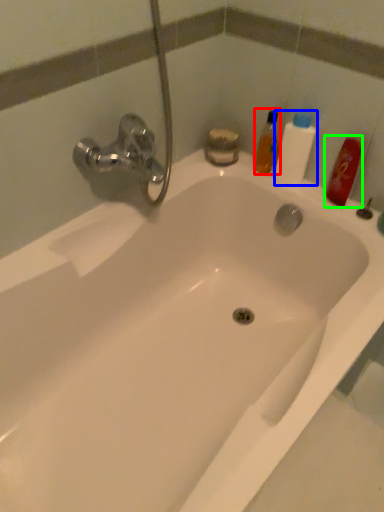
Question: Considering the real-world distances, which object is farthest from mouthwash (highlighted by a red box)? cleaning product (highlighted by a blue box) or mouthwash (highlighted by a green box)?

Choices:
 (A) cleaning product
 (B) mouthwash

Answer: (B)